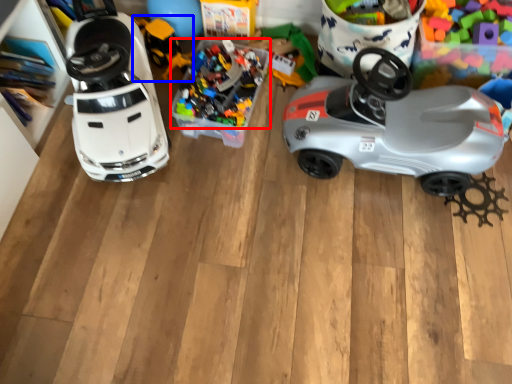
Question: Which point is further to the camera, toy (highlighted by a red box) or toy (highlighted by a blue box)?

Choices:
 (A) toy
 (B) toy

Answer: (B)